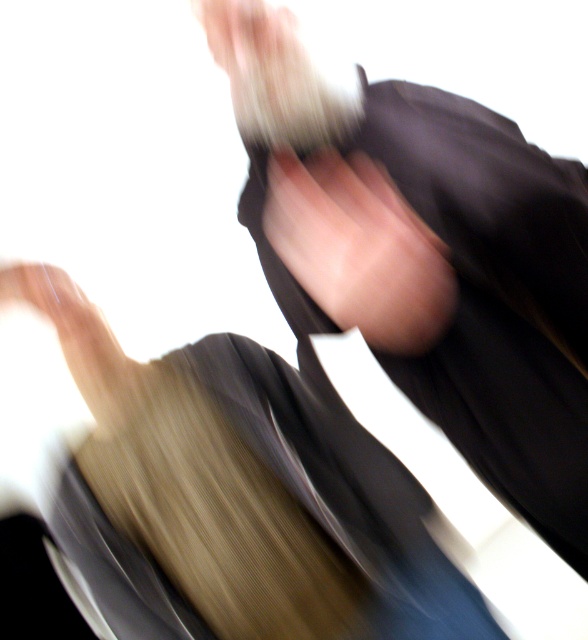
Can you confirm if smooth skin at center is taller than smooth beige hand at lower left?

Correct, smooth skin at center is much taller as smooth beige hand at lower left.

Can you confirm if smooth skin at center is thinner than smooth beige hand at lower left?

In fact, smooth skin at center might be wider than smooth beige hand at lower left.

Identify the location of smooth skin at center. Image resolution: width=588 pixels, height=640 pixels. (359, 250).